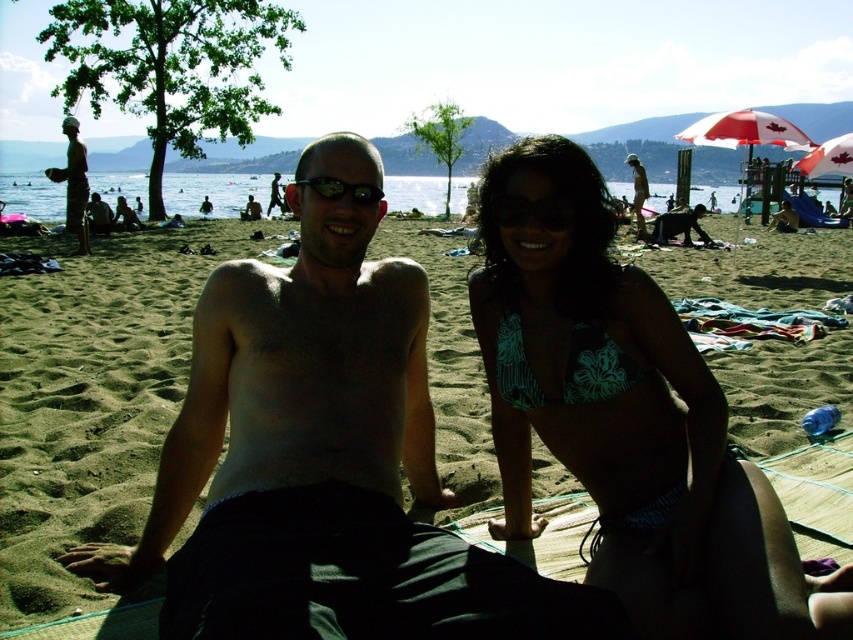
Is white fabric umbrella at upper right further to camera compared to black plastic sunglasses at center?

Yes, it is.

Is white fabric umbrella at upper right smaller than black plastic sunglasses at center?

Incorrect, white fabric umbrella at upper right is not smaller in size than black plastic sunglasses at center.

Does point (845, 157) lie in front of point (331, 198)?

No.

The width and height of the screenshot is (853, 640). Find the location of `white fabric umbrella at upper right`. white fabric umbrella at upper right is located at coordinates (828, 157).

Can you confirm if green matte goggles at center is positioned above white fabric umbrella at upper right?

No, green matte goggles at center is not above white fabric umbrella at upper right.

Does point (556, 204) come in front of point (845, 150)?

That is True.

Which is in front, point (497, 225) or point (844, 176)?

Point (497, 225)

Find the location of a particular element. This screenshot has height=640, width=853. green matte goggles at center is located at coordinates (531, 211).

Does point (846, 173) lie in front of point (637, 209)?

Yes.

The height and width of the screenshot is (640, 853). I want to click on white fabric umbrella at upper right, so click(x=828, y=157).